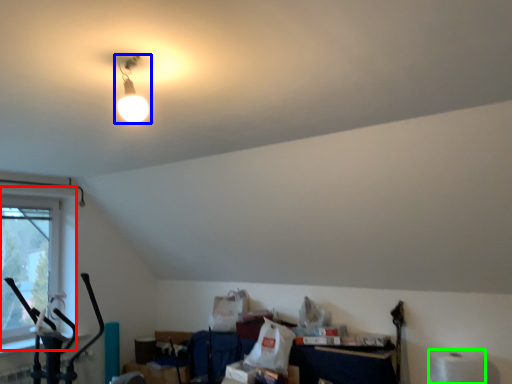
Question: Considering the real-world distances, which object is closest to window (highlighted by a red box)? lamp (highlighted by a blue box) or toilet paper (highlighted by a green box).

Choices:
 (A) lamp
 (B) toilet paper

Answer: (A)